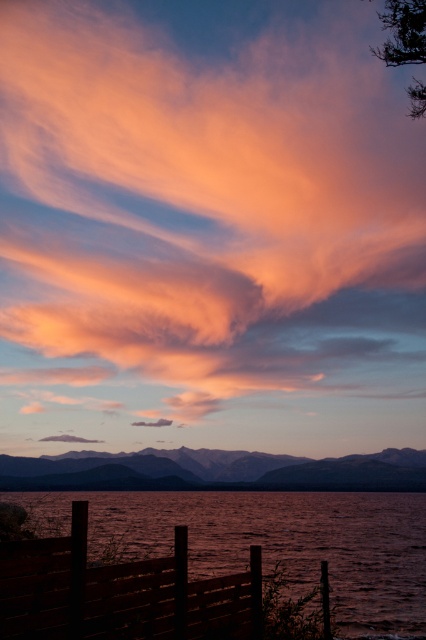
Can you confirm if matte orange cloud at upper center is bigger than dull brown water at lower left?

Correct, matte orange cloud at upper center is larger in size than dull brown water at lower left.

Between matte orange cloud at upper center and dull brown water at lower left, which one has less height?

With less height is dull brown water at lower left.

Where is `matte orange cloud at upper center`? matte orange cloud at upper center is located at coordinates (209, 227).

This screenshot has height=640, width=426. In order to click on matte orange cloud at upper center in this screenshot , I will do `click(209, 227)`.